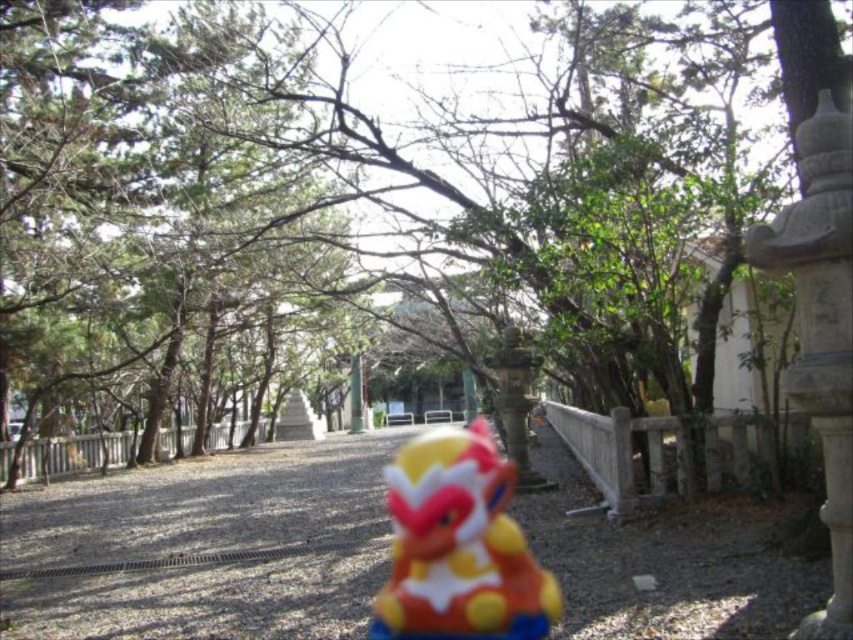
Does point (180, 483) lie behind point (451, 481)?

Yes, it is.

Does smooth gravel path at center have a lesser height compared to matte plastic toy at center?

In fact, smooth gravel path at center may be taller than matte plastic toy at center.

Does point (573, 484) come behind point (486, 579)?

Yes, it is behind point (486, 579).

Identify the location of smooth gravel path at center. tap(202, 547).